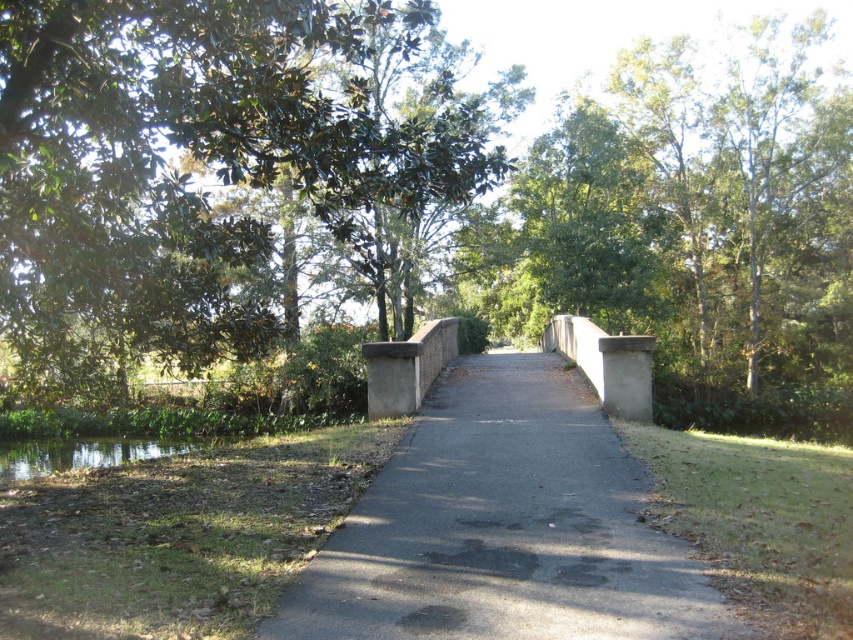
You are a gardener planning to plant a new tree in the area. Considering the green leafy tree at upper left and the gray asphalt pavement at center, which object is wider?

The green leafy tree at upper left is wider than the gray asphalt pavement at center.

You are standing on the paved bridge and looking towards the green leafy tree at upper left and the green reflective water at lower left. Which object is taller?

The green leafy tree at upper left is much taller than the green reflective water at lower left.